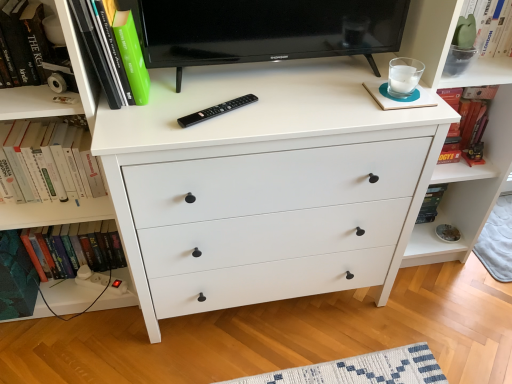
Question: Considering the positions of green matte plant at upper right and hardcover book at left, acting as the second book starting from the top, in the image, is green matte plant at upper right taller or shorter than hardcover book at left, acting as the second book starting from the top,?

Choices:
 (A) short
 (B) tall

Answer: (A)

Question: From the image's perspective, is green matte plant at upper right located above or below hardcover book at left, which is counted as the second book, starting from the bottom?

Choices:
 (A) above
 (B) below

Answer: (A)

Question: Estimate the real-world distances between objects in this image. Which object is farther from the teal matte book at left?

Choices:
 (A) black glossy tv at upper center
 (B) black plastic remote at center
 (C) white matte chest of drawers at center
 (D) green matte book at upper left, the first book from the top
 (E) hardcover book at left, which is the third book from top to bottom

Answer: (A)

Question: Which object is positioned closest to the black plastic remote at center?

Choices:
 (A) green matte plant at upper right
 (B) hardcover book at left, which is counted as the second book, starting from the bottom
 (C) teal matte book at left
 (D) hardcover book at left, which is the first book from bottom to top
 (E) white matte chest of drawers at center

Answer: (E)